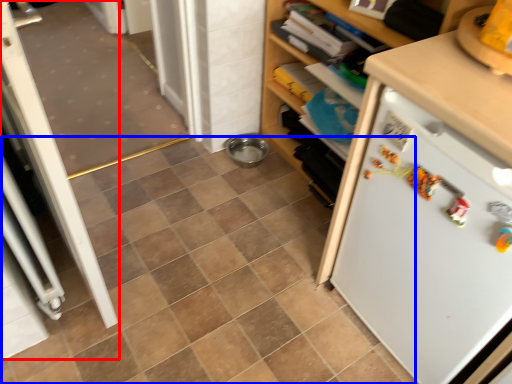
Question: Which of the following is the closest to the observer, screen door (highlighted by a red box) or ceramic tile (highlighted by a blue box)?

Choices:
 (A) screen door
 (B) ceramic tile

Answer: (A)